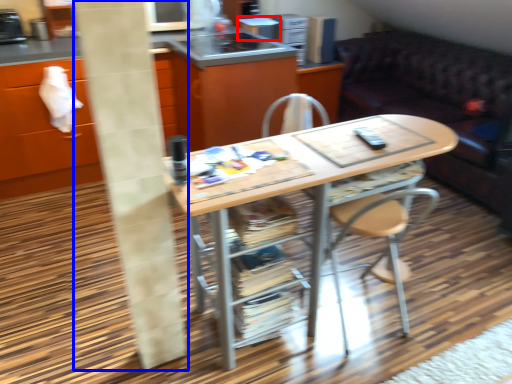
Question: Which of the following is the farthest to the observer, appliance (highlighted by a red box) or pillar (highlighted by a blue box)?

Choices:
 (A) appliance
 (B) pillar

Answer: (A)